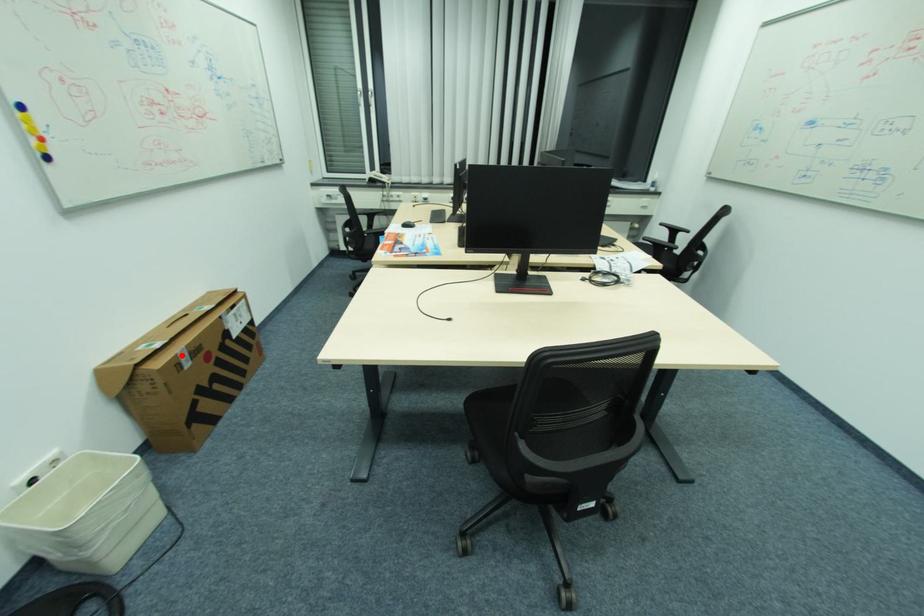
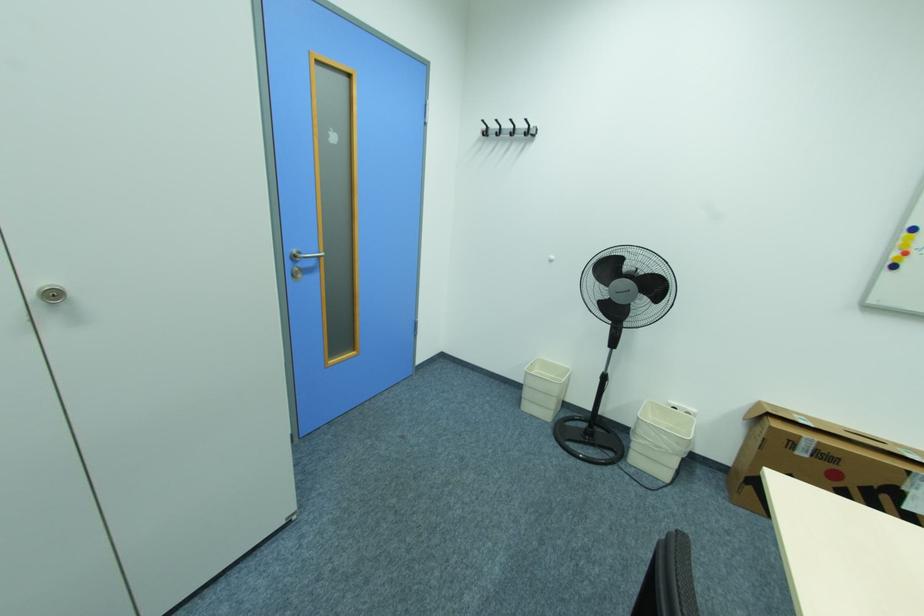
Question: I am providing you with two images of the same scene from different viewpoints. In image1, a red point is highlighted. Considering the same 3D point in image2, which of the following is correct?

Choices:
 (A) It is closer
 (B) It is farther

Answer: (B)